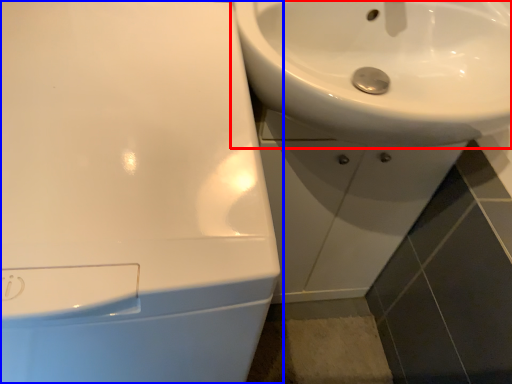
Question: Which object is further to the camera taking this photo, sink (highlighted by a red box) or sink (highlighted by a blue box)?

Choices:
 (A) sink
 (B) sink

Answer: (A)